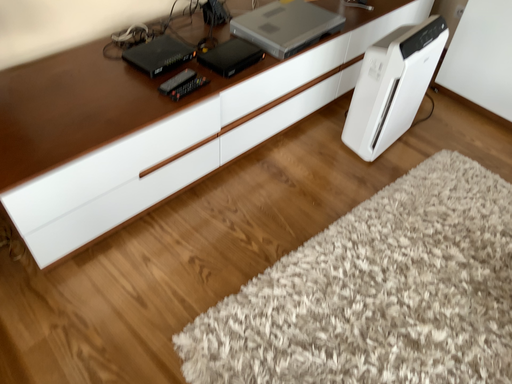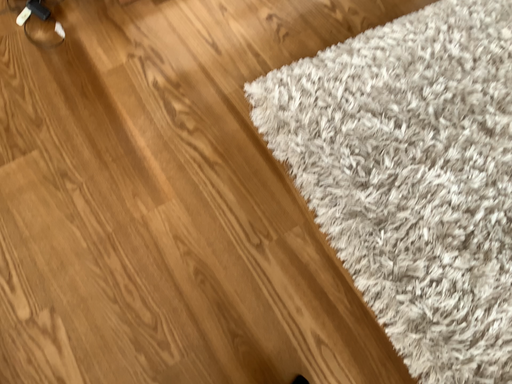
Question: How did the camera likely rotate when shooting the video?

Choices:
 (A) rotated left
 (B) rotated right

Answer: (A)